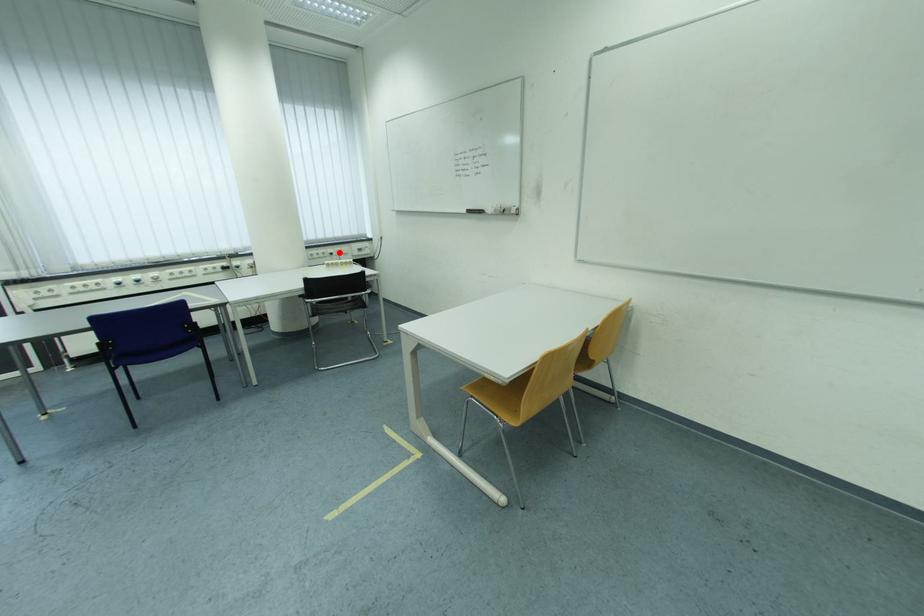
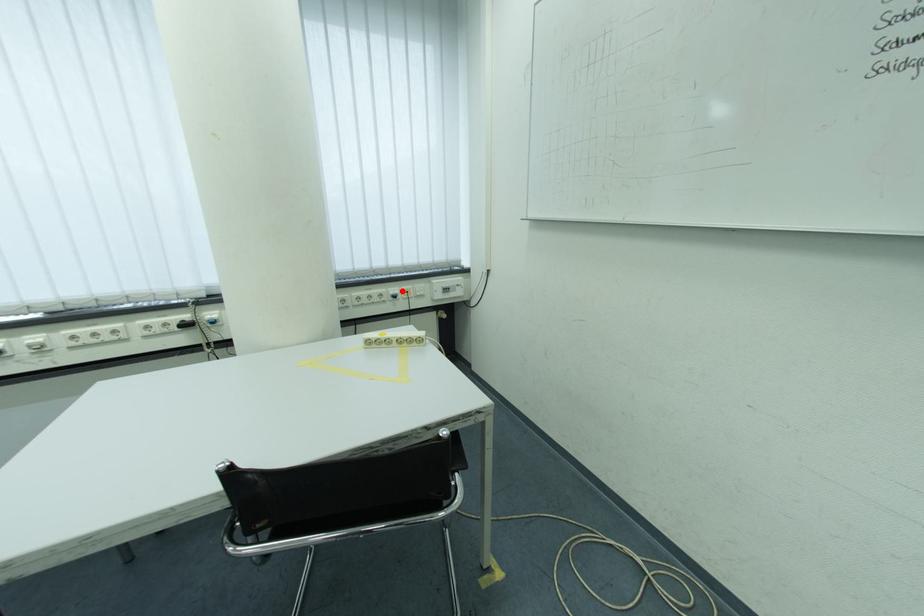
I am providing you with two images of the same scene from different viewpoints. A red point is marked on the first image and another point is marked on the second image. Is the marked point in image1 the same physical position as the marked point in image2?

Yes